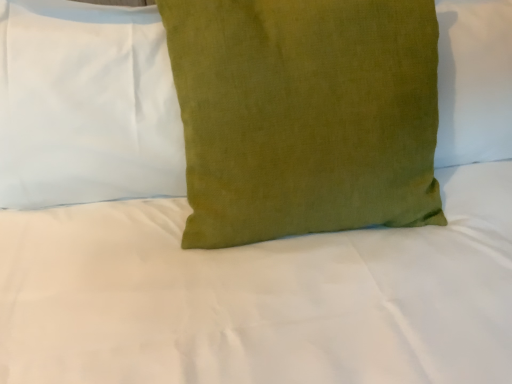
Question: From the image's perspective, is green linen pillow at center, the second pillow viewed from the left, positioned above or below green linen pillow at center, the second pillow when ordered from right to left?

Choices:
 (A) above
 (B) below

Answer: (B)

Question: Considering the positions of green linen pillow at center, the second pillow viewed from the left, and green linen pillow at center, the second pillow when ordered from right to left, in the image, is green linen pillow at center, the second pillow viewed from the left, wider or thinner than green linen pillow at center, the second pillow when ordered from right to left,?

Choices:
 (A) thin
 (B) wide

Answer: (B)

Question: Based on their sizes in the image, would you say green linen pillow at center, marked as the first pillow in a right-to-left arrangement, is bigger or smaller than green linen pillow at center, the second pillow when ordered from right to left?

Choices:
 (A) small
 (B) big

Answer: (B)

Question: From a real-world perspective, is green linen pillow at center, acting as the first pillow starting from the left, positioned above or below green linen pillow at center, the second pillow viewed from the left?

Choices:
 (A) above
 (B) below

Answer: (A)

Question: Considering the relative positions of green linen pillow at center, the second pillow when ordered from right to left, and green linen pillow at center, the second pillow viewed from the left, in the image provided, is green linen pillow at center, the second pillow when ordered from right to left, to the left or to the right of green linen pillow at center, the second pillow viewed from the left,?

Choices:
 (A) left
 (B) right

Answer: (A)

Question: Considering the positions of green linen pillow at center, the second pillow when ordered from right to left, and green linen pillow at center, marked as the first pillow in a right-to-left arrangement, in the image, is green linen pillow at center, the second pillow when ordered from right to left, bigger or smaller than green linen pillow at center, marked as the first pillow in a right-to-left arrangement,?

Choices:
 (A) small
 (B) big

Answer: (A)

Question: Is green linen pillow at center, the second pillow when ordered from right to left, spatially inside green linen pillow at center, the second pillow viewed from the left, or outside of it?

Choices:
 (A) outside
 (B) inside

Answer: (A)